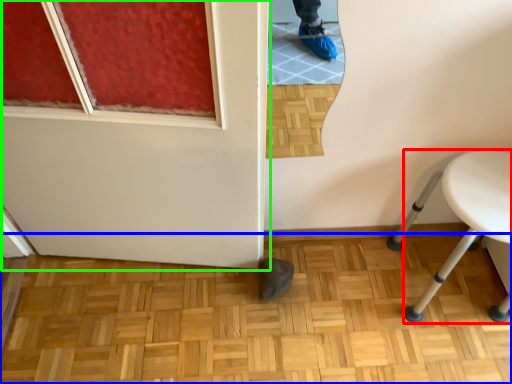
Question: Which is farther away from furniture (highlighted by a red box)? hardwood (highlighted by a blue box) or door (highlighted by a green box)?

Choices:
 (A) hardwood
 (B) door

Answer: (B)